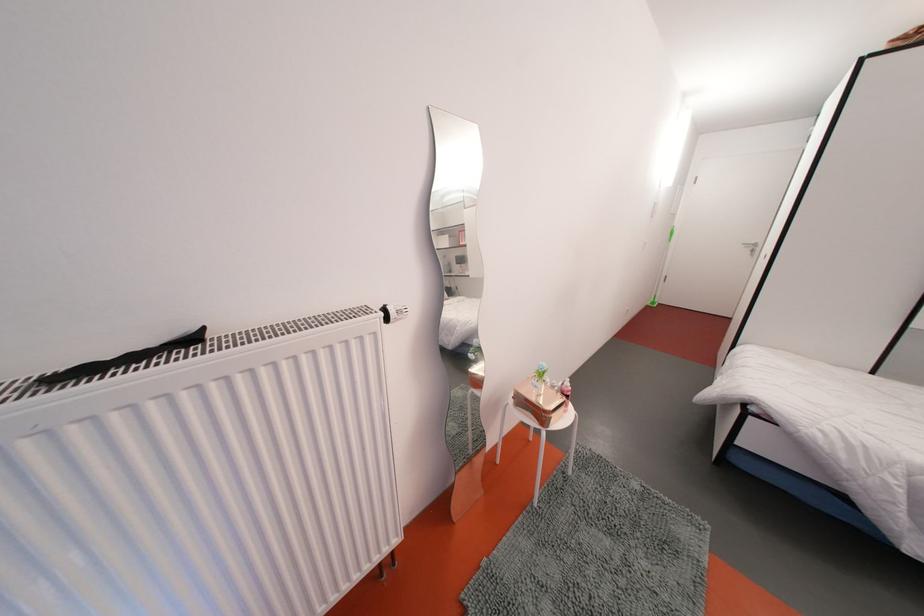
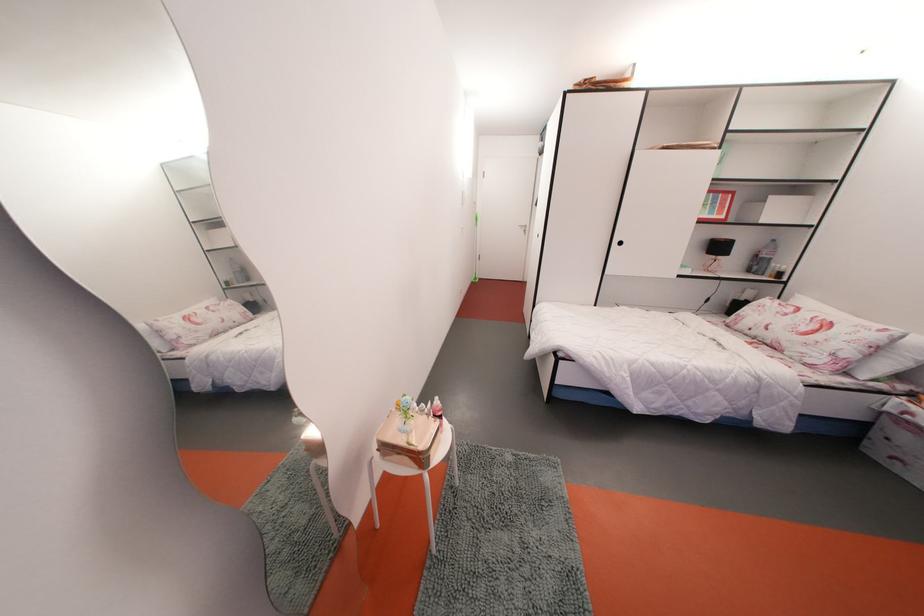
Question: The images are taken continuously from a first-person perspective. In which direction is your viewpoint rotating?

Choices:
 (A) Left
 (B) Right
 (C) Up
 (D) Down

Answer: (B)